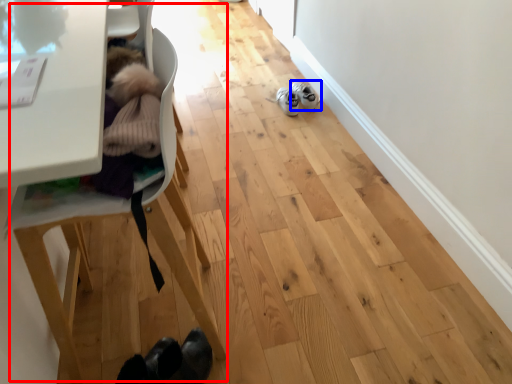
Question: Which object is further to the camera taking this photo, baby carriage (highlighted by a red box) or footwear (highlighted by a blue box)?

Choices:
 (A) baby carriage
 (B) footwear

Answer: (B)